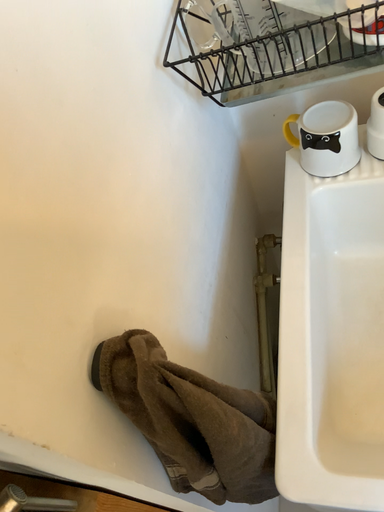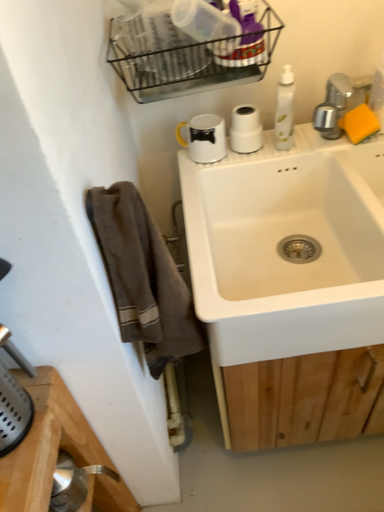
Question: How did the camera likely rotate when shooting the video?

Choices:
 (A) rotated right
 (B) rotated left

Answer: (A)